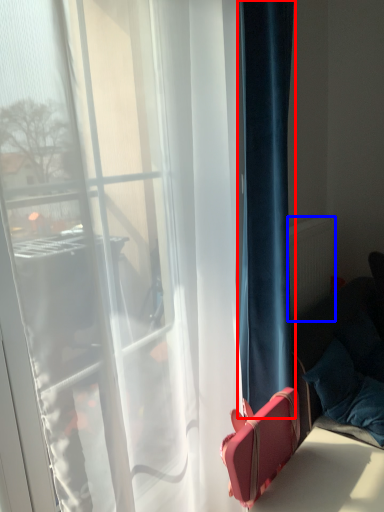
Question: Which object is closer to the camera taking this photo, curtain (highlighted by a red box) or radiator (highlighted by a blue box)?

Choices:
 (A) curtain
 (B) radiator

Answer: (A)